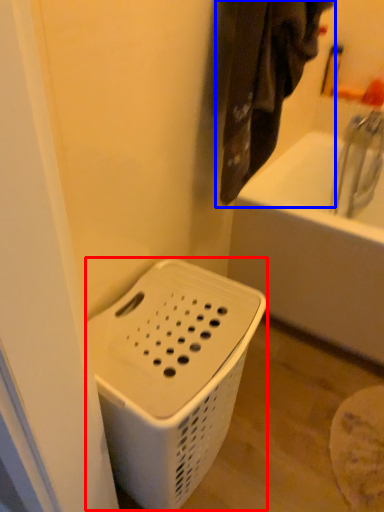
Question: Which of the following is the closest to the observer, basket container (highlighted by a red box) or laundry (highlighted by a blue box)?

Choices:
 (A) basket container
 (B) laundry

Answer: (A)